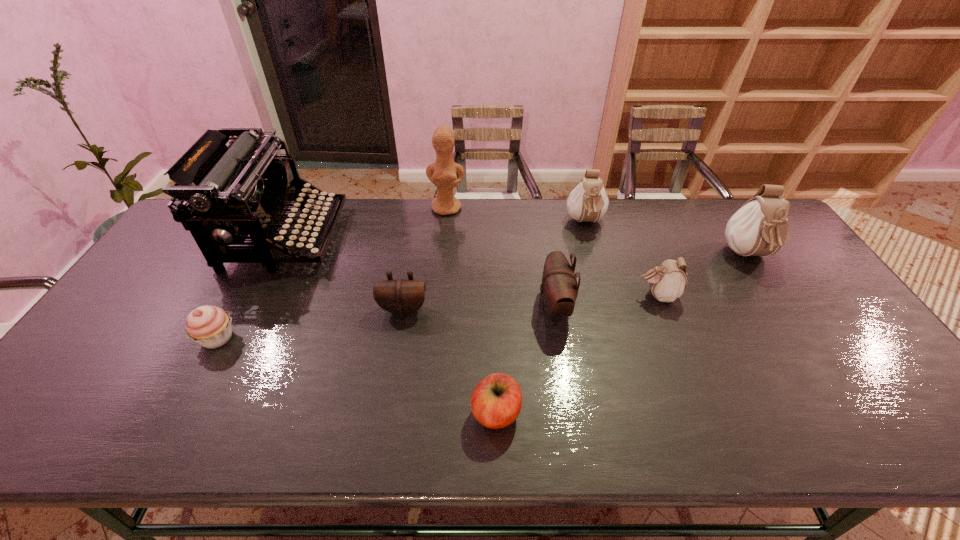
Where is `the smaller brown pouch`? the smaller brown pouch is located at coordinates (401, 297).

You are a GUI agent. You are given a task and a screenshot of the screen. Output one action in this format:
    pyautogui.click(x=<x>, y=<y>)
    Task: Click on the left brown pouch
    Image resolution: width=960 pixels, height=540 pixels.
    Given the screenshot: What is the action you would take?
    pyautogui.click(x=401, y=297)

This screenshot has height=540, width=960. Identify the location of cupcake. (210, 326).

Identify the location of the nearest object. (496, 401).

Locate an element on the screen. apple is located at coordinates (496, 401).

The width and height of the screenshot is (960, 540). Identify the location of vacant position located on the typing side of the typewriter. (429, 237).

Locate an element on the screen. Image resolution: width=960 pixels, height=540 pixels. blank space located 0.090m on the front-facing side of the figurine is located at coordinates (444, 233).

Identify the location of blank area located 0.210m on the front-facing side of the rightmost object. (800, 334).

At what (x,y) coordinates should I click in order to perform the action: click on vacant space situated on the front-facing side of the third object from right to left. Please return your answer as a coordinate pair (x, y). The image size is (960, 540). Looking at the image, I should click on click(x=607, y=297).

At what (x,y) coordinates should I click in order to perform the action: click on free spot located 0.060m with the flap open on the fourth object from right to left. Please return your answer as a coordinate pair (x, y). Looking at the image, I should click on (516, 307).